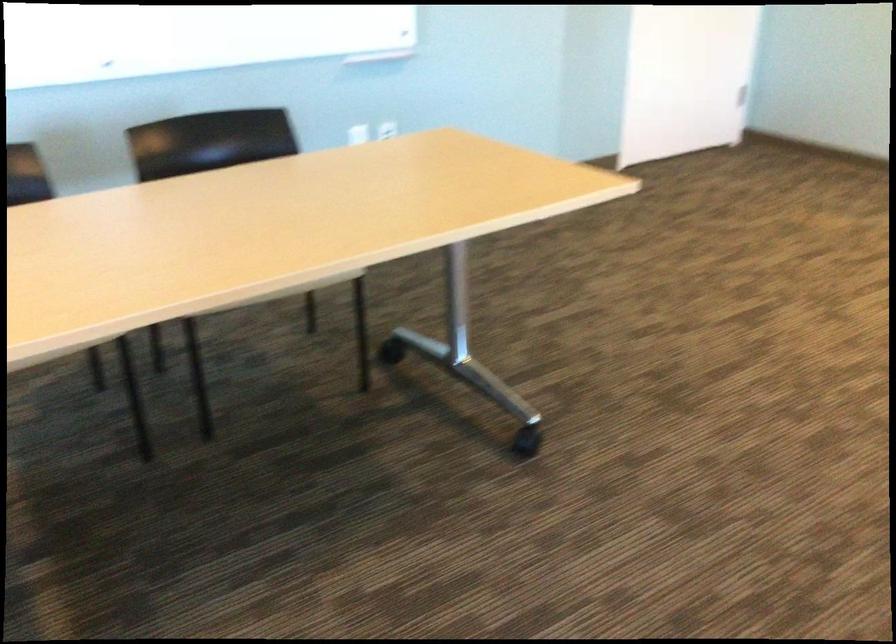
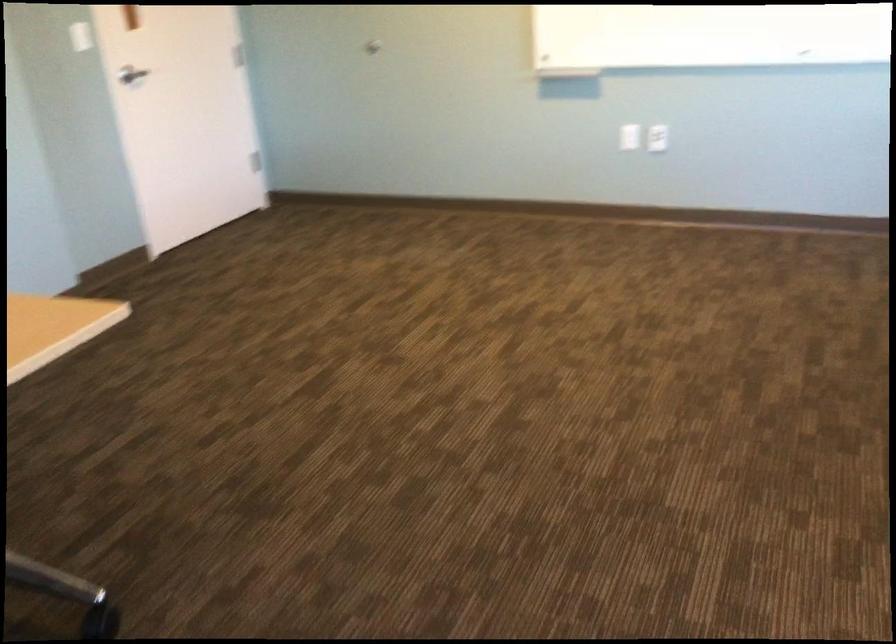
Question: The camera is either moving clockwise (left) or counter-clockwise (right) around the object. The first image is from the beginning of the video and the second image is from the end. Is the camera moving left or right when shooting the video?

Choices:
 (A) Left
 (B) Right

Answer: (A)